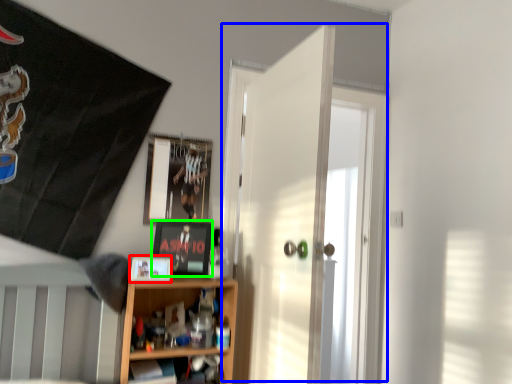
Question: Based on their relative distances, which object is farther from picture frame (highlighted by a red box)? Choose from door (highlighted by a blue box) and picture frame (highlighted by a green box).

Choices:
 (A) door
 (B) picture frame

Answer: (A)